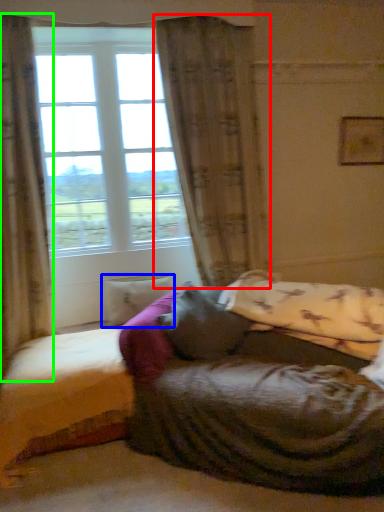
Question: Considering the real-world distances, which object is farthest from curtain (highlighted by a red box)? pillow (highlighted by a blue box) or curtain (highlighted by a green box)?

Choices:
 (A) pillow
 (B) curtain

Answer: (B)